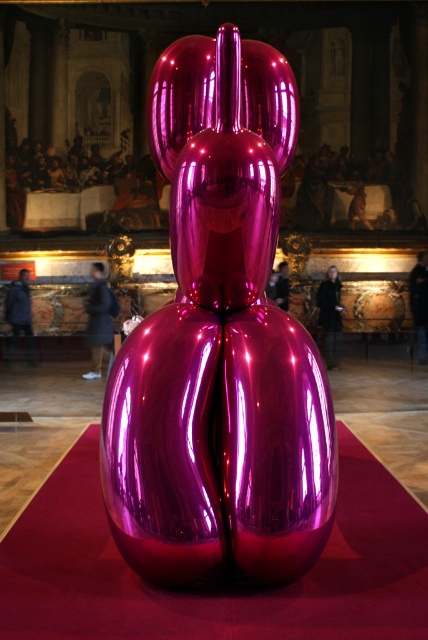
Question: Which of the following is the closest to the observer?

Choices:
 (A) (14, 307)
 (B) (427, 316)

Answer: (A)

Question: Which point is closer to the camera?

Choices:
 (A) dark blue fabric jacket at center
 (B) glossy metallic balloon at center

Answer: (B)

Question: Can you confirm if dark blue fabric jacket at center is smaller than dark brown leather jacket at center?

Choices:
 (A) yes
 (B) no

Answer: (B)

Question: Can you confirm if dark brown leather jacket at center is wider than dark blue jeans at lower right?

Choices:
 (A) no
 (B) yes

Answer: (B)

Question: Among these objects, which one is farthest from the camera?

Choices:
 (A) dark brown leather jacket at center
 (B) glossy purple mat at center

Answer: (A)

Question: Can you confirm if dark blue fabric jacket at center is smaller than denim jacket at left?

Choices:
 (A) no
 (B) yes

Answer: (A)